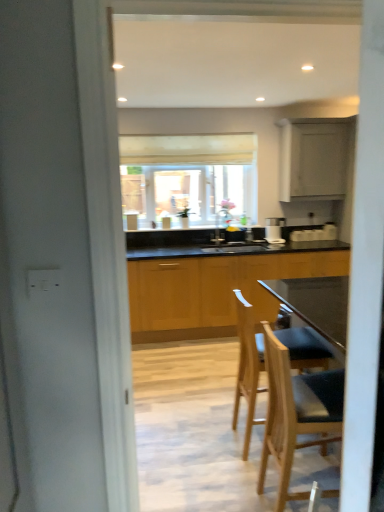
Question: Can wooden bar stool at center, the 1th chair in the front-to-back sequence, be found inside wooden cabinets at center, which is the 2th cabinetry in top-to-bottom order?

Choices:
 (A) no
 (B) yes

Answer: (A)

Question: From the image's perspective, would you say wooden cabinets at center, arranged as the first cabinetry when ordered from the bottom, is shown under wooden bar stool at center, positioned as the second chair in back-to-front order?

Choices:
 (A) yes
 (B) no

Answer: (B)

Question: Could you tell me if wooden cabinets at center, which is the 2th cabinetry in top-to-bottom order, is turned towards wooden bar stool at center, the 1th chair in the front-to-back sequence?

Choices:
 (A) no
 (B) yes

Answer: (B)

Question: Can you confirm if wooden cabinets at center, arranged as the first cabinetry when ordered from the bottom, is shorter than wooden bar stool at center, the 1th chair in the front-to-back sequence?

Choices:
 (A) no
 (B) yes

Answer: (A)

Question: Is wooden cabinets at center, which is the 2th cabinetry in top-to-bottom order, taller than wooden bar stool at center, the 1th chair in the front-to-back sequence?

Choices:
 (A) no
 (B) yes

Answer: (B)

Question: Looking at the image, does matte wood cabinet at upper right, placed as the 2th cabinetry when sorted from bottom to top, seem bigger or smaller compared to wooden cabinets at center, arranged as the first cabinetry when ordered from the bottom?

Choices:
 (A) small
 (B) big

Answer: (A)

Question: From the image's perspective, is matte wood cabinet at upper right, placed as the 2th cabinetry when sorted from bottom to top, above or below wooden cabinets at center, arranged as the first cabinetry when ordered from the bottom?

Choices:
 (A) below
 (B) above

Answer: (B)

Question: Is matte wood cabinet at upper right, placed as the 2th cabinetry when sorted from bottom to top, inside or outside of wooden cabinets at center, arranged as the first cabinetry when ordered from the bottom?

Choices:
 (A) outside
 (B) inside

Answer: (A)

Question: From a real-world perspective, is matte wood cabinet at upper right, placed as the 2th cabinetry when sorted from bottom to top, physically located above or below wooden cabinets at center, arranged as the first cabinetry when ordered from the bottom?

Choices:
 (A) above
 (B) below

Answer: (A)

Question: In terms of width, does light wood bar stool at center, which is the first chair in back-to-front order, look wider or thinner when compared to wooden bar stool at center, positioned as the second chair in back-to-front order?

Choices:
 (A) thin
 (B) wide

Answer: (B)

Question: Based on their positions, is light wood bar stool at center, which is counted as the second chair, starting from the front, located to the left or right of wooden bar stool at center, positioned as the second chair in back-to-front order?

Choices:
 (A) left
 (B) right

Answer: (A)

Question: From the image's perspective, is light wood bar stool at center, which is counted as the second chair, starting from the front, above or below wooden bar stool at center, positioned as the second chair in back-to-front order?

Choices:
 (A) below
 (B) above

Answer: (B)

Question: Is light wood bar stool at center, which is counted as the second chair, starting from the front, spatially inside wooden bar stool at center, positioned as the second chair in back-to-front order, or outside of it?

Choices:
 (A) inside
 (B) outside

Answer: (B)

Question: Choose the correct answer: Is matte wood cabinet at upper right, which is the 1th cabinetry in top-to-bottom order, inside matte white window at center or outside it?

Choices:
 (A) inside
 (B) outside

Answer: (B)

Question: Based on their sizes in the image, would you say matte wood cabinet at upper right, which is the 1th cabinetry in top-to-bottom order, is bigger or smaller than matte white window at center?

Choices:
 (A) small
 (B) big

Answer: (A)